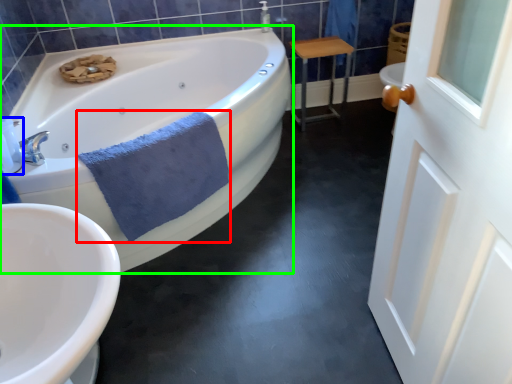
Question: Considering the real-world distances, which object is farthest from bath towel (highlighted by a red box)? toiletry (highlighted by a blue box) or bathtub (highlighted by a green box)?

Choices:
 (A) toiletry
 (B) bathtub

Answer: (B)